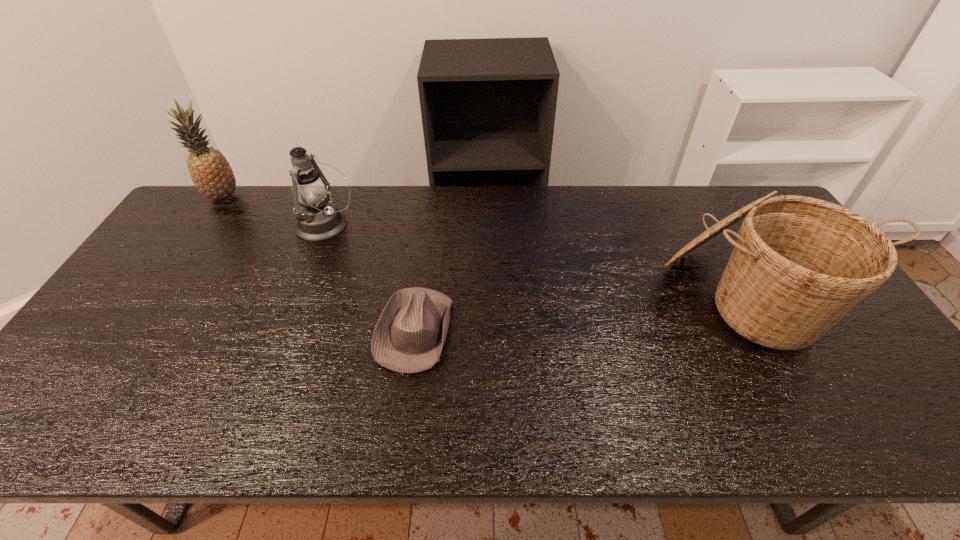
Identify the location of the leftmost object. (212, 175).

You are a GUI agent. You are given a task and a screenshot of the screen. Output one action in this format:
    pyautogui.click(x=<x>, y=<y>)
    Task: Click on the pineapple
    
    Given the screenshot: What is the action you would take?
    pyautogui.click(x=212, y=175)

The height and width of the screenshot is (540, 960). Identify the location of the rightmost object. (800, 264).

This screenshot has height=540, width=960. I want to click on the second object from left to right, so click(318, 219).

The height and width of the screenshot is (540, 960). Find the location of `the third nearest object`. the third nearest object is located at coordinates (318, 219).

This screenshot has height=540, width=960. Find the location of `the second object from right to left`. the second object from right to left is located at coordinates (409, 336).

You are a GUI agent. You are given a task and a screenshot of the screen. Output one action in this format:
    pyautogui.click(x=<x>, y=<y>)
    Task: Click on the shortest object
    
    Given the screenshot: What is the action you would take?
    pyautogui.click(x=409, y=336)

Locate an element on the screen. The image size is (960, 540). vacant space located 0.210m on the right of the leftmost object is located at coordinates (301, 197).

What are the coordinates of `vacant region located on the left of the rightmost object` in the screenshot? It's located at (556, 296).

Locate an element on the screen. The height and width of the screenshot is (540, 960). free space located on the right of the second object from left to right is located at coordinates (401, 226).